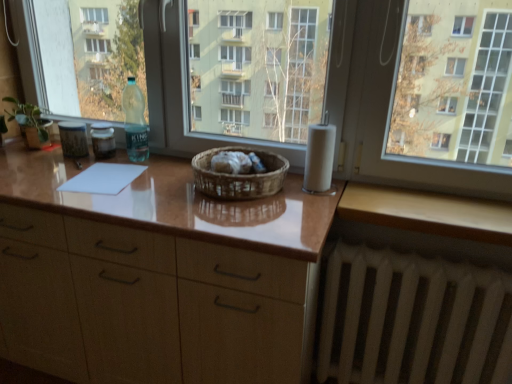
Locate an element on the screen. vacant space in front of woven brown basket at center is located at coordinates (237, 223).